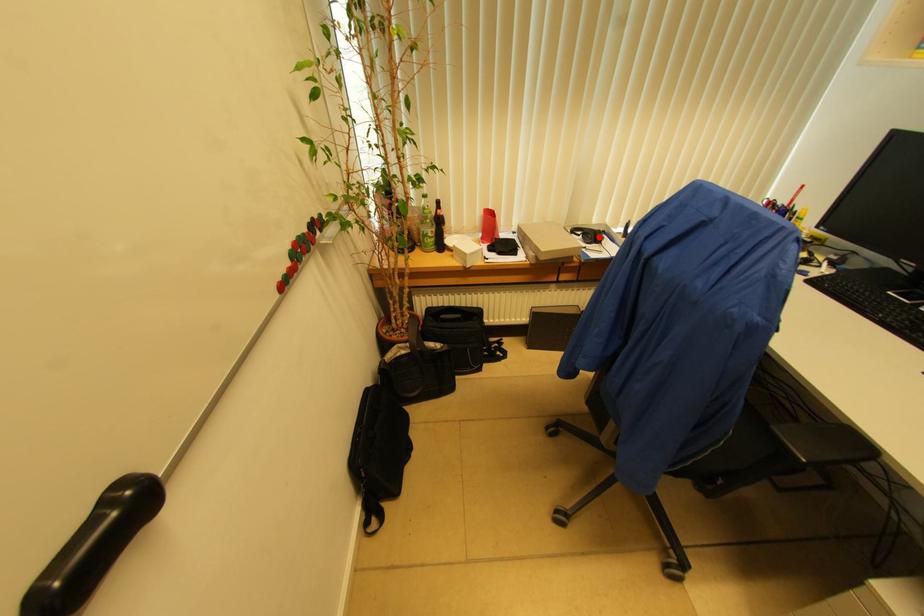
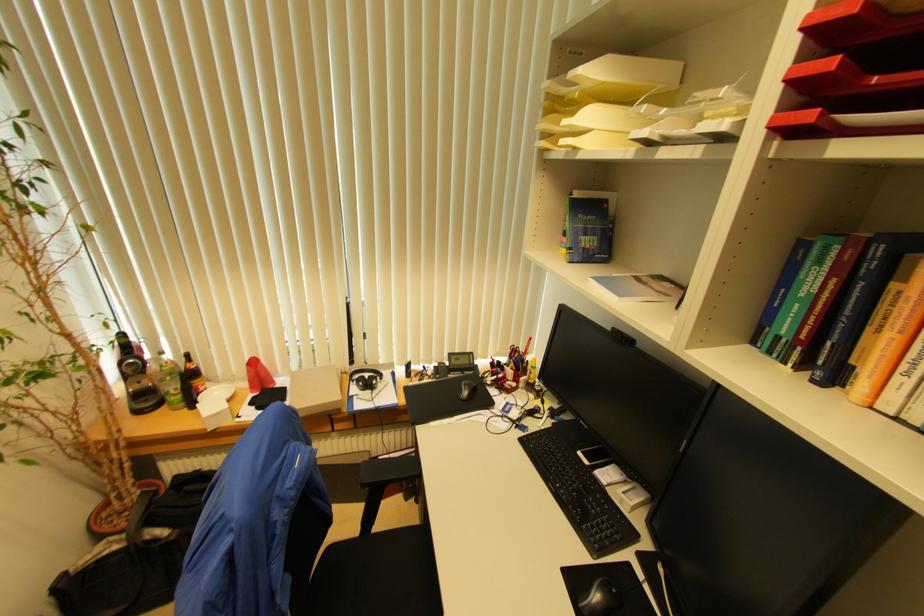
Locate, in the second image, the point that corresponds to the highlighted location in the first image.

(371, 384)